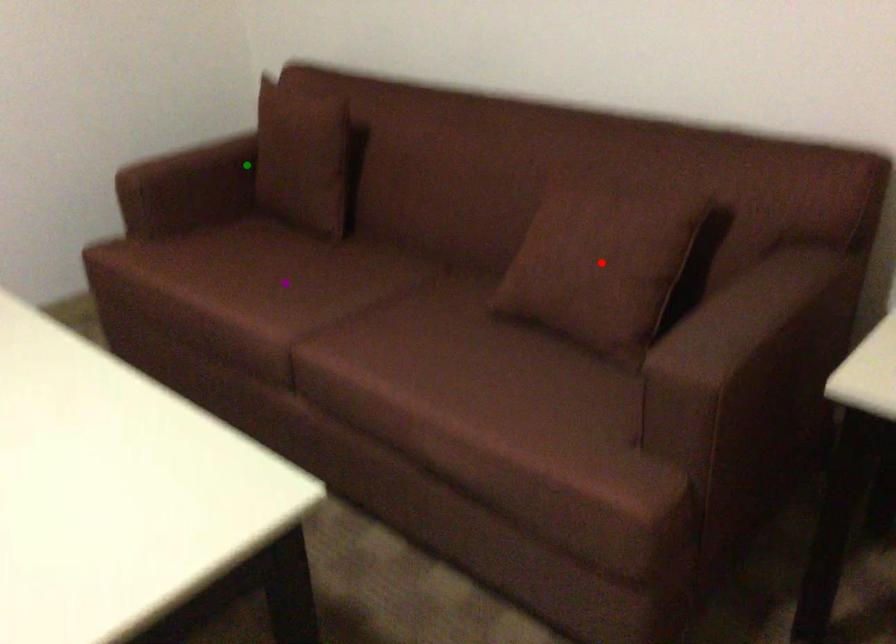
Order these from nearest to farthest:
A) red point
B) green point
C) purple point

1. green point
2. purple point
3. red point